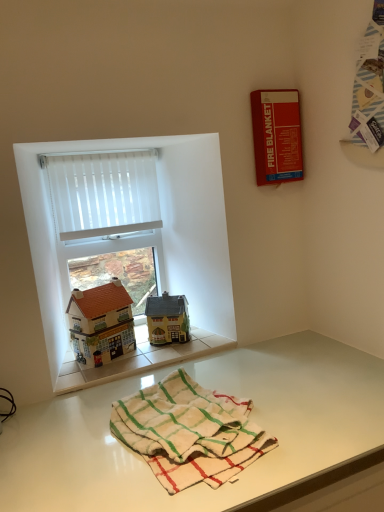
Locate an element on the screen. Image resolution: width=384 pixels, height=512 pixels. unoccupied region to the right of matte yellow house at center, the 2th toy positioned from the left is located at coordinates (204, 339).